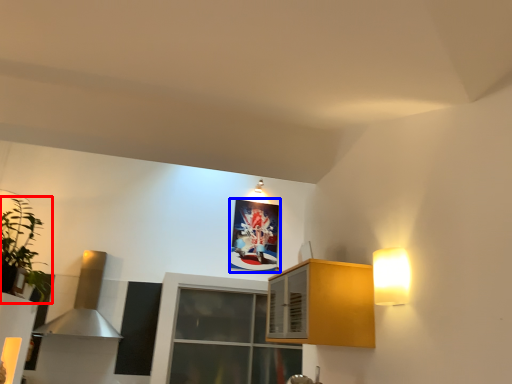
Question: Which point is further to the camera, houseplant (highlighted by a red box) or picture frame (highlighted by a blue box)?

Choices:
 (A) houseplant
 (B) picture frame

Answer: (B)